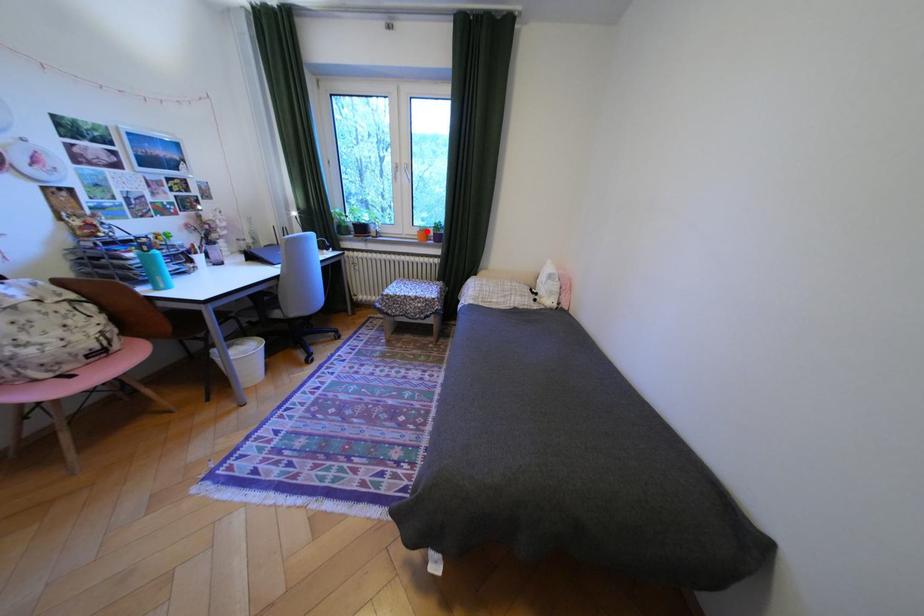
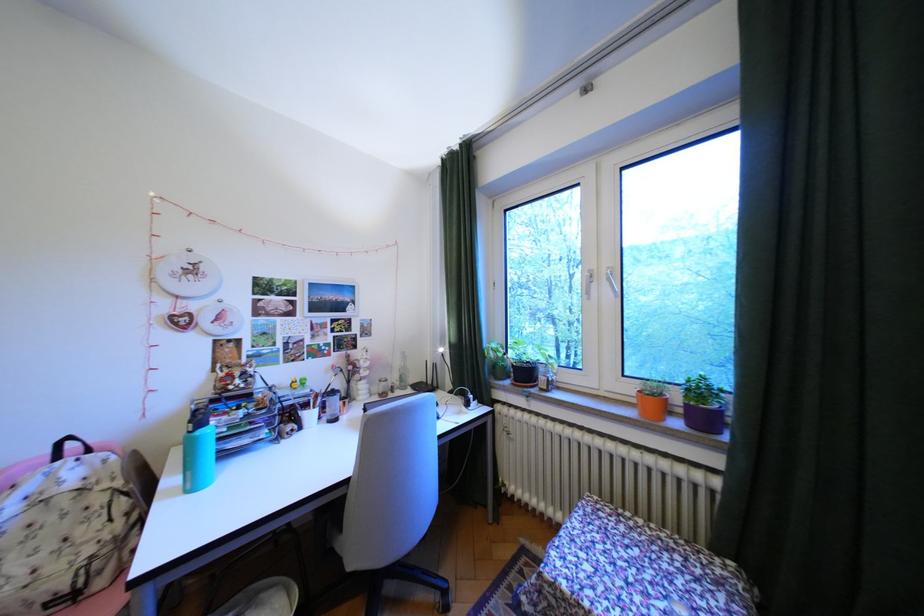
Question: I am providing you with two images of the same scene from different viewpoints. Image1 has a red point marked. In image2, the corresponding 3D location appears at what relative position? Reply with the corresponding letter.

Choices:
 (A) Closer
 (B) Farther

Answer: (B)